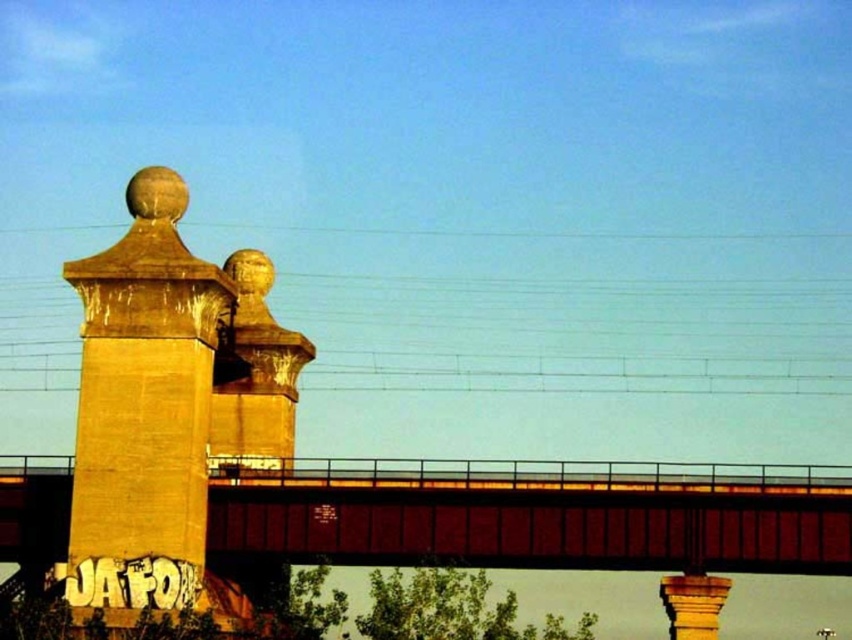
You are a painter who needs to cover the entire width of the metallic bridge at center and the yellowish concrete pillar at left. If you have a 10m long paint roller, which object can you cover completely without needing to move the roller?

The yellowish concrete pillar at left can be covered completely with the 10m paint roller since the metallic bridge at center is wider than the yellowish concrete pillar at left, meaning the pillar requires less than 10m to cover its width while the bridge may exceed the roller length.

You are a photographer standing on the bridge and want to capture both the yellowish concrete pillar at left and the gold textured ball at upper center in your shot. Which object will appear larger in your photo?

The yellowish concrete pillar at left will appear larger in the photo because it is closer to the viewer than the gold textured ball at upper center.

You are standing on the metallic bridge at center and want to take a photo of the yellowish concrete pillar at left. Since the pillar is farther away, will it appear smaller in the photo compared to the bridge?

Yes, the yellowish concrete pillar at left is farther away from the viewer than the metallic bridge at center, so it will appear smaller in the photo.